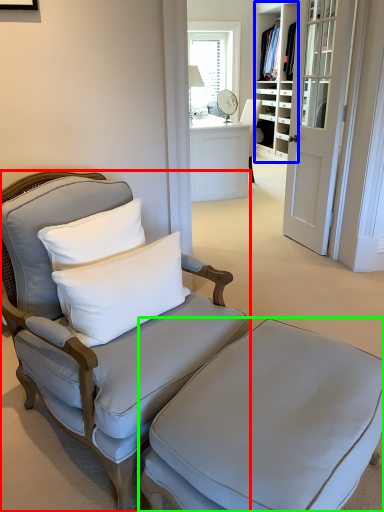
Question: Which object is positioned farthest from chair (highlighted by a red box)? Select from bookshelf (highlighted by a blue box) and table (highlighted by a green box).

Choices:
 (A) bookshelf
 (B) table

Answer: (A)